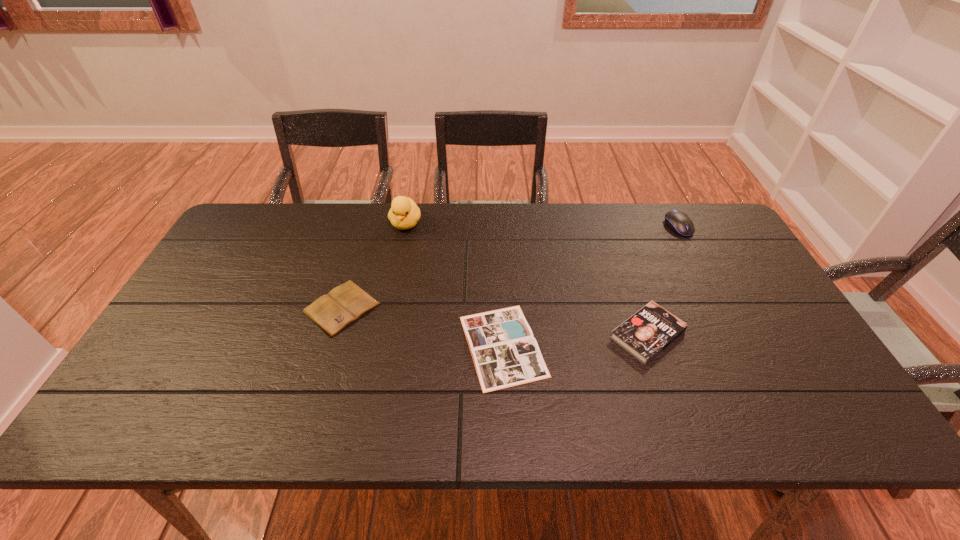
This screenshot has height=540, width=960. I want to click on free space between the third object from right to left and the leftmost book, so click(x=422, y=327).

Locate an element on the screen. This screenshot has width=960, height=540. vacant region between the second tallest object and the second object from right to left is located at coordinates (663, 280).

What are the coordinates of `object that ranks as the closest to the second book from left to right` in the screenshot? It's located at (649, 331).

Locate which object is the second closest to the tallest book. Please provide its 2D coordinates. Your answer should be formatted as a tuple, i.e. [(x, y)], where the tuple contains the x and y coordinates of a point satisfying the conditions above.

[(679, 222)]

Find the location of a particular element. the third closest book to the rightmost object is located at coordinates (343, 305).

Identify the location of book that is the closest one to the fourth shortest object. This screenshot has width=960, height=540. (649, 331).

Locate an element on the screen. This screenshot has height=540, width=960. vacant space that satisfies the following two spatial constraints: 1. on the front-facing side of the second book from right to left; 2. on the left side of the tallest object is located at coordinates (381, 346).

You are a GUI agent. You are given a task and a screenshot of the screen. Output one action in this format:
    pyautogui.click(x=<x>, y=<y>)
    Task: Click on the vacant space that satisfies the following two spatial constraints: 1. on the front-facing side of the duck; 2. on the right side of the computer mouse
    The width and height of the screenshot is (960, 540).
    Given the screenshot: What is the action you would take?
    pyautogui.click(x=405, y=226)